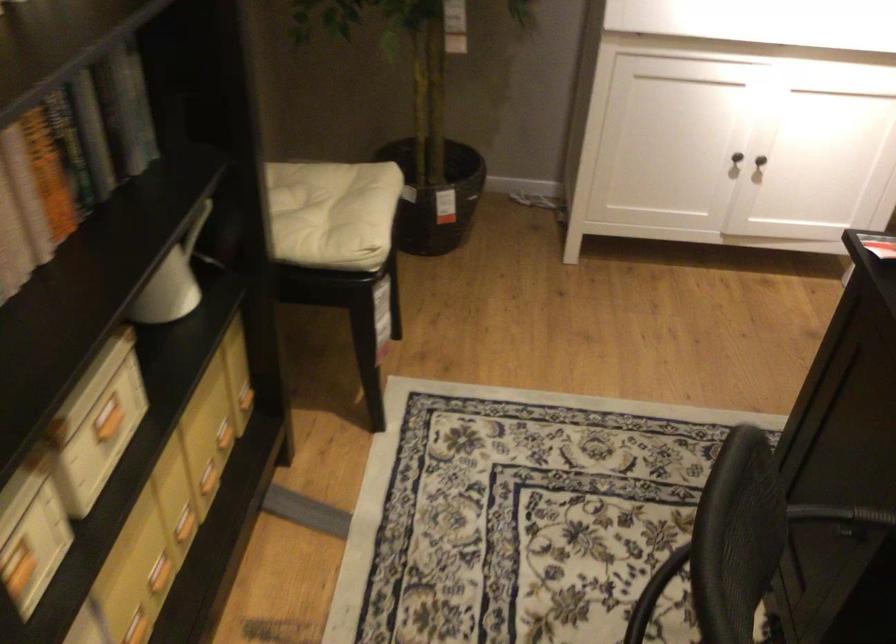
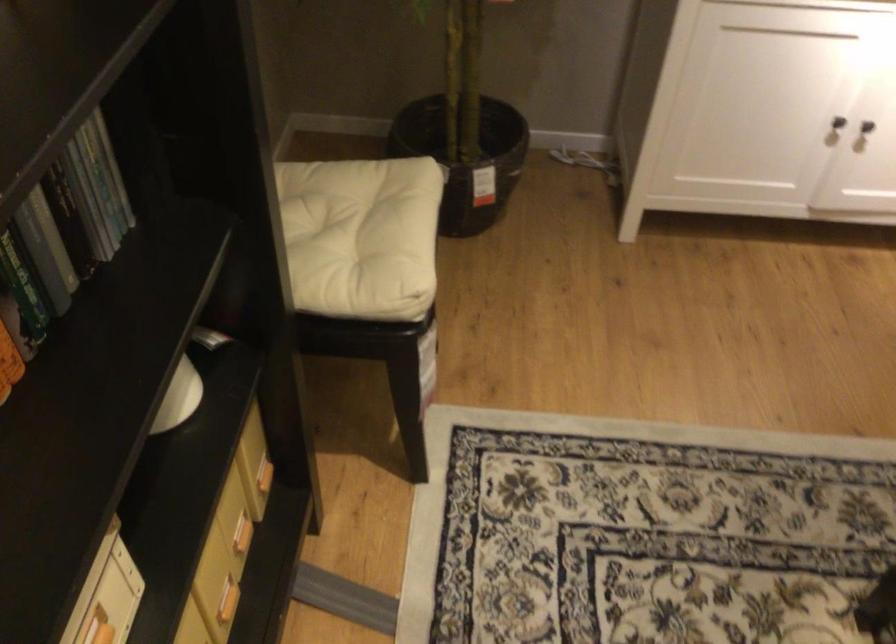
Locate, in the second image, the point that corresponds to [243,399] in the first image.

(263, 476)